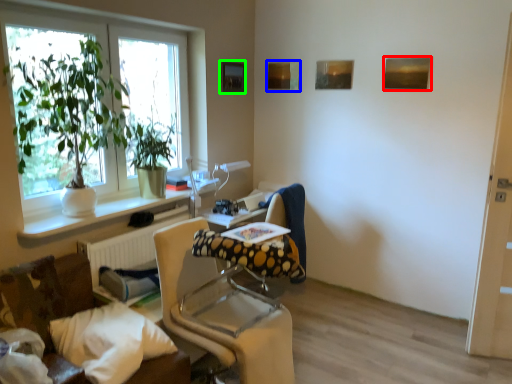
Question: Based on their relative distances, which object is farther from picture frame (highlighted by a red box)? Choose from picture frame (highlighted by a blue box) and picture frame (highlighted by a green box).

Choices:
 (A) picture frame
 (B) picture frame

Answer: (B)